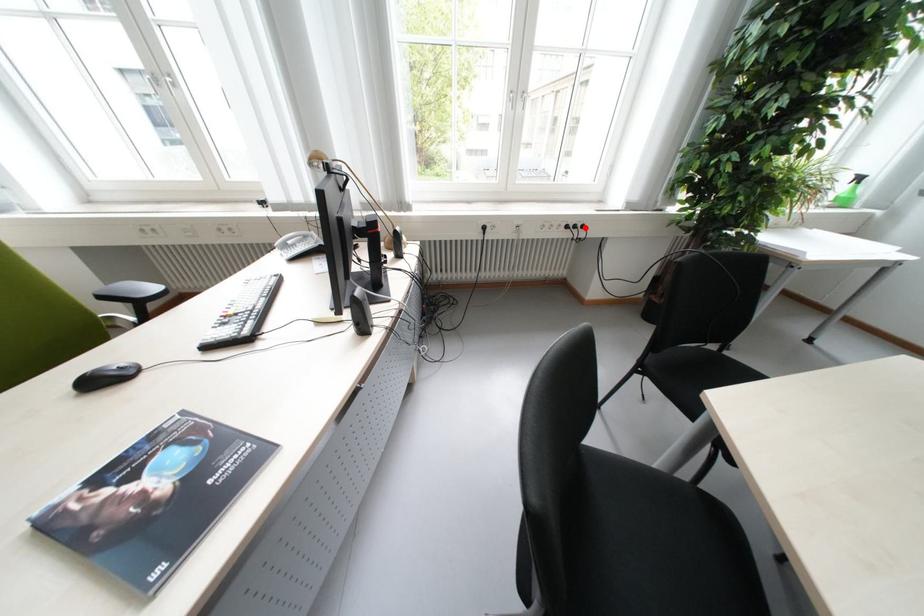
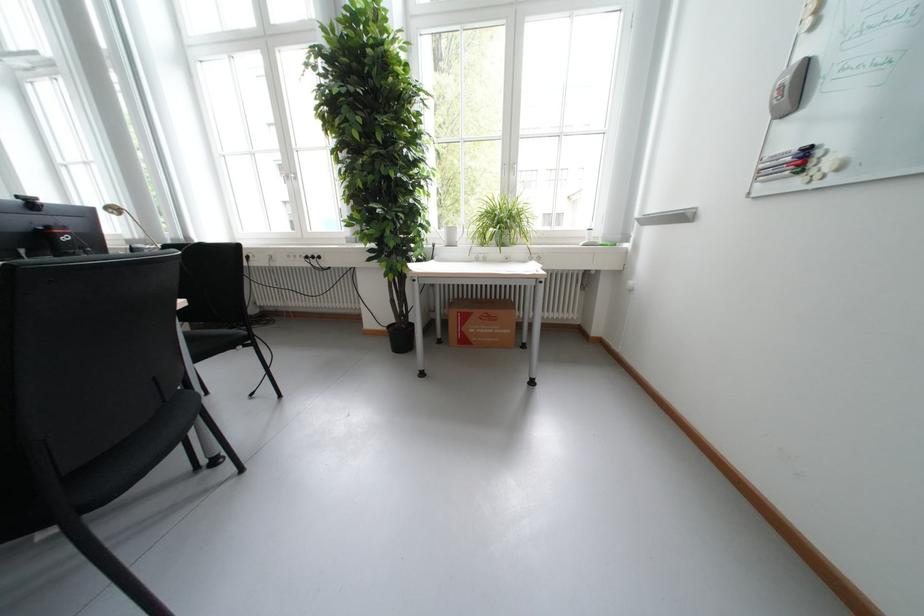
Find the pixel in the second image that matches the highlighted location in the first image.

(322, 257)